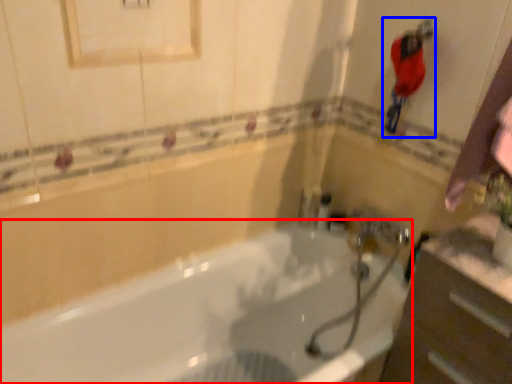
Question: Which of the following is the closest to the observer, bathtub (highlighted by a red box) or person (highlighted by a blue box)?

Choices:
 (A) bathtub
 (B) person

Answer: (A)